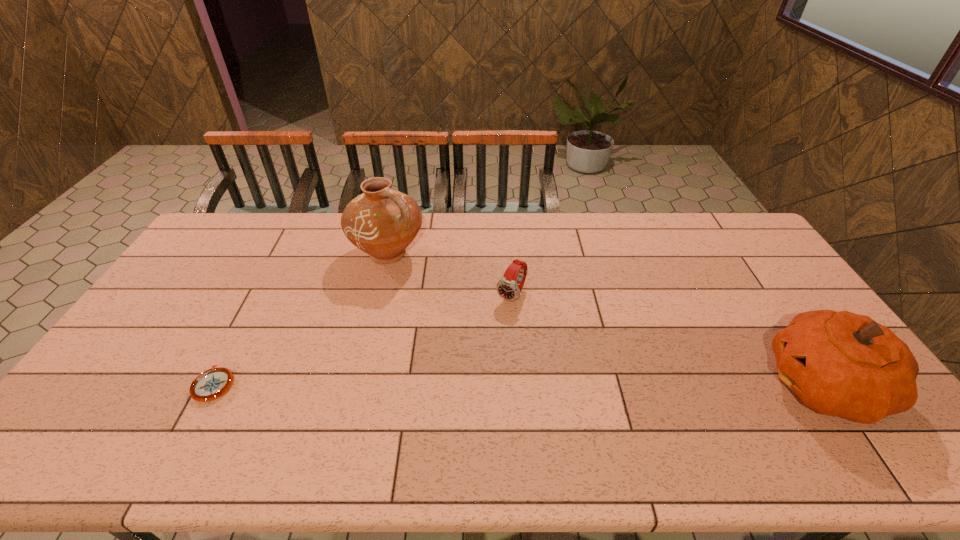
You are a GUI agent. You are given a task and a screenshot of the screen. Output one action in this format:
    pyautogui.click(x=<x>, y=<y>)
    Task: Click on the object that is the second closest to the third object from left to right
    
    Given the screenshot: What is the action you would take?
    pyautogui.click(x=842, y=364)

The height and width of the screenshot is (540, 960). What are the coordinates of `free spot that satisfies the following two spatial constraints: 1. on the back side of the second farthest object; 2. on the right side of the leftmost object` in the screenshot? It's located at (261, 295).